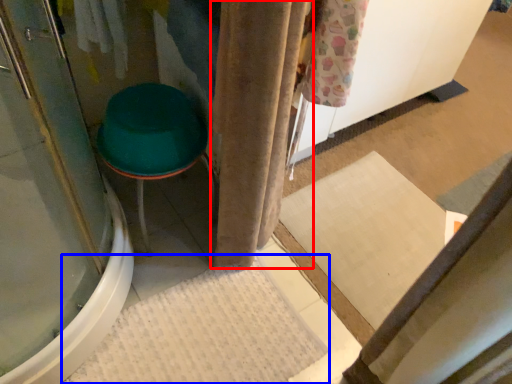
Question: Which object appears closest to the camera in this image, curtain (highlighted by a red box) or bath mat (highlighted by a blue box)?

Choices:
 (A) curtain
 (B) bath mat

Answer: (A)